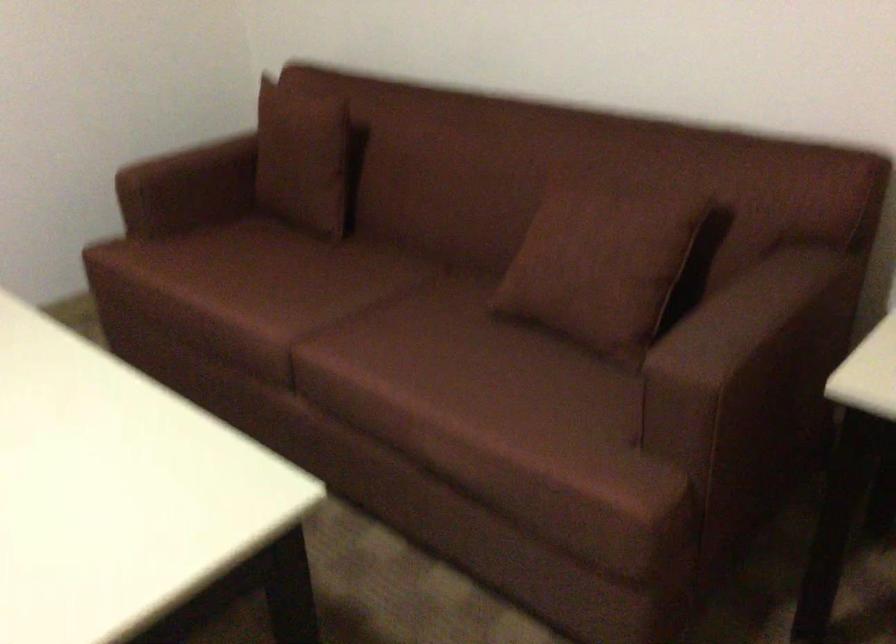
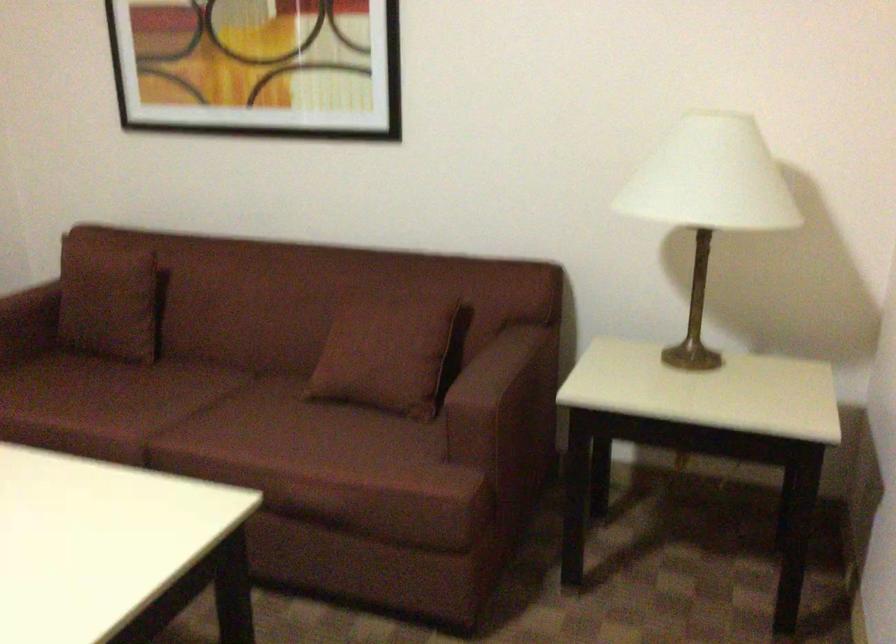
Question: The camera is either moving clockwise (left) or counter-clockwise (right) around the object. The first image is from the beginning of the video and the second image is from the end. Is the camera moving left or right when shooting the video?

Choices:
 (A) Left
 (B) Right

Answer: (A)